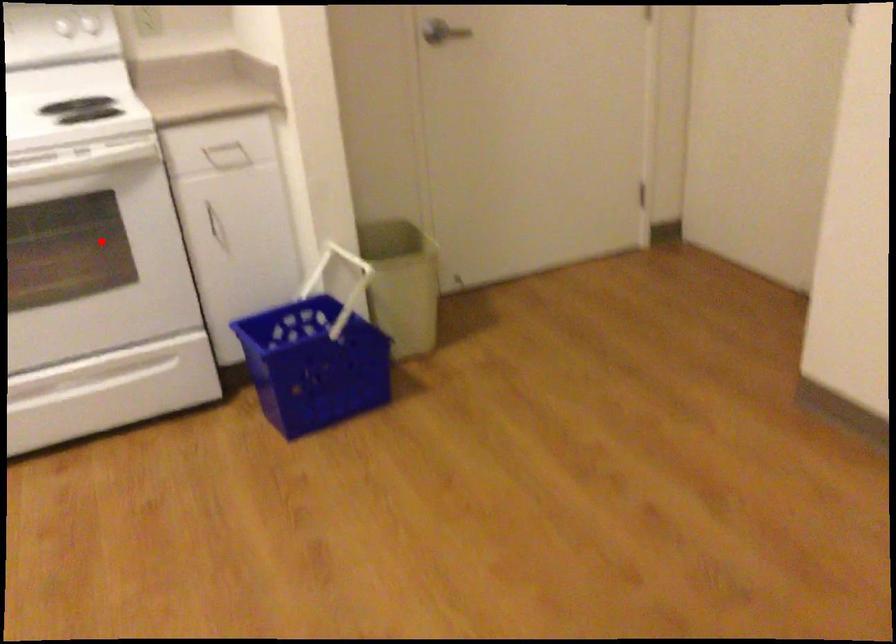
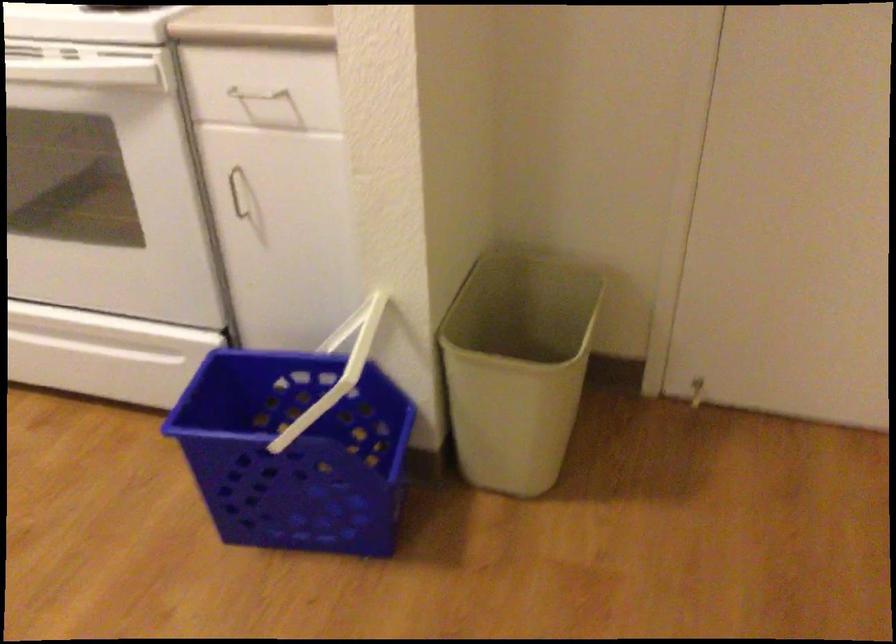
In the second image, find the point that corresponds to the highlighted location in the first image.

(104, 185)